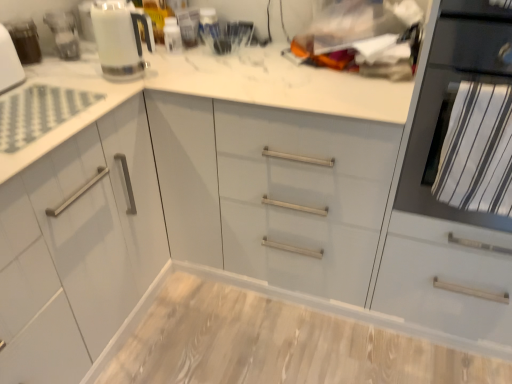
I want to click on vacant point to the right of white glossy kettle at upper left, so coord(172,72).